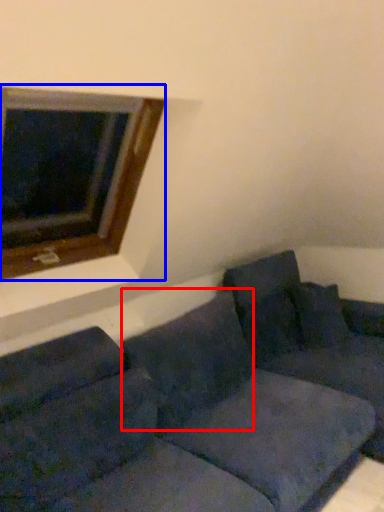
Question: Which of the following is the farthest to the observer, pillow (highlighted by a red box) or window (highlighted by a blue box)?

Choices:
 (A) pillow
 (B) window

Answer: (A)